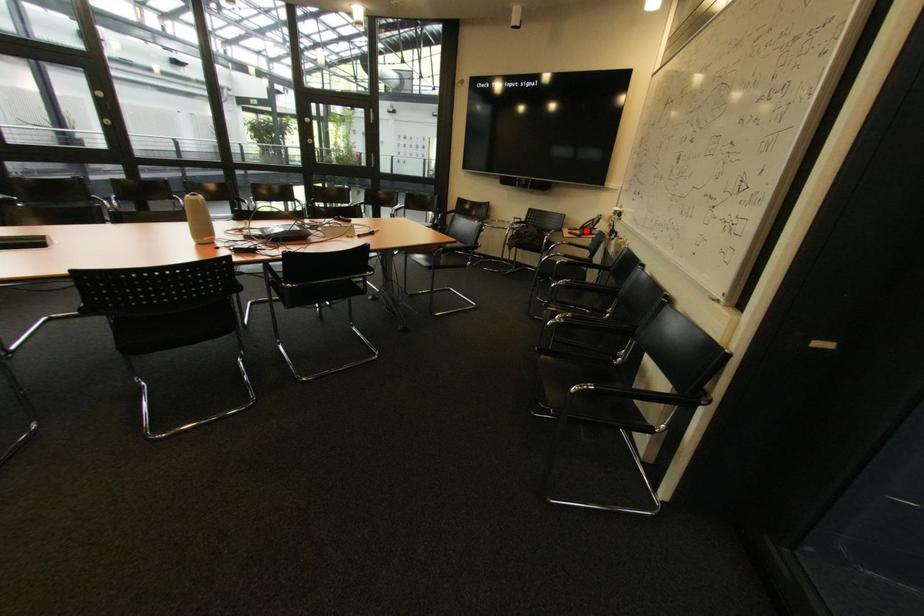
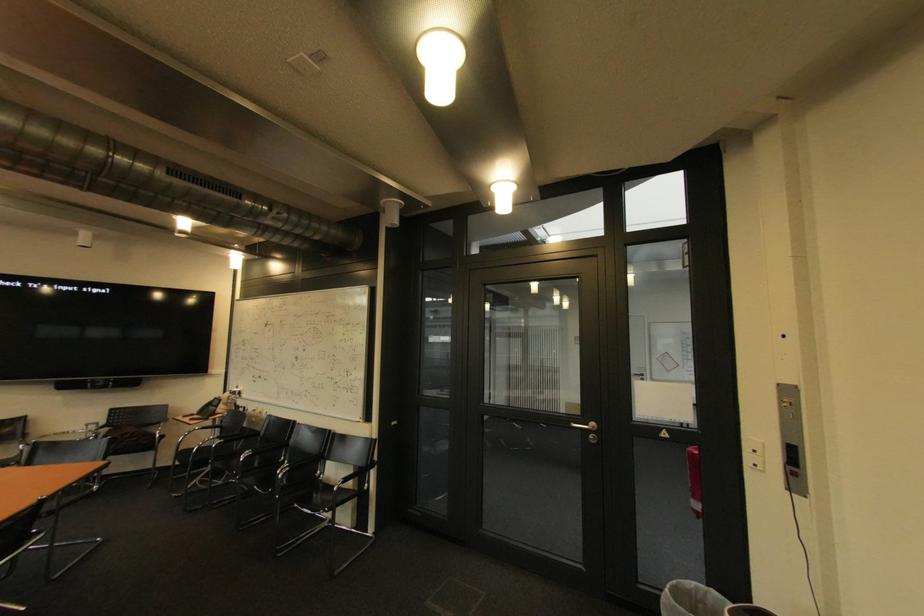
Question: I am providing you with two images of the same scene from different viewpoints. In image1, a red point is highlighted. Considering the same 3D point in image2, which of the following is correct?

Choices:
 (A) It is closer
 (B) It is farther

Answer: (B)